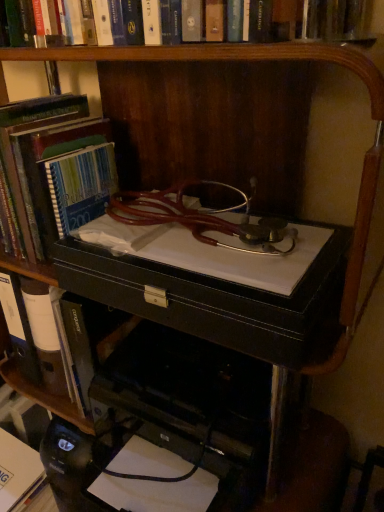
Question: Is black leather drawer at center located outside white paper at lower left, which ranks as the first book in bottom-to-top order?

Choices:
 (A) yes
 (B) no

Answer: (A)

Question: Is black leather drawer at center at the right side of white paper at lower left, marked as the third book in a top-to-bottom arrangement?

Choices:
 (A) no
 (B) yes

Answer: (B)

Question: Does black leather drawer at center turn towards white paper at lower left, which ranks as the first book in bottom-to-top order?

Choices:
 (A) no
 (B) yes

Answer: (A)

Question: Is black leather drawer at center touching white paper at lower left, which ranks as the first book in bottom-to-top order?

Choices:
 (A) no
 (B) yes

Answer: (A)

Question: From a real-world perspective, is black leather drawer at center beneath white paper at lower left, marked as the third book in a top-to-bottom arrangement?

Choices:
 (A) yes
 (B) no

Answer: (B)

Question: Is black leather drawer at center turned away from white paper at lower left, marked as the third book in a top-to-bottom arrangement?

Choices:
 (A) no
 (B) yes

Answer: (A)

Question: From a real-world perspective, is black leather book at center, marked as the 2th book in a bottom-to-top arrangement, on top of black leather computer desk at center?

Choices:
 (A) no
 (B) yes

Answer: (B)

Question: From the image's perspective, is black leather book at center, marked as the 2th book in a bottom-to-top arrangement, below black leather computer desk at center?

Choices:
 (A) no
 (B) yes

Answer: (A)

Question: Does black leather book at center, arranged as the 2th book when viewed from the top, appear on the right side of black leather computer desk at center?

Choices:
 (A) no
 (B) yes

Answer: (A)

Question: Is black leather book at center, arranged as the 2th book when viewed from the top, turned away from black leather computer desk at center?

Choices:
 (A) yes
 (B) no

Answer: (B)

Question: Is black leather book at center, marked as the 2th book in a bottom-to-top arrangement, outside black leather computer desk at center?

Choices:
 (A) no
 (B) yes

Answer: (B)

Question: Are black leather book at center, marked as the 2th book in a bottom-to-top arrangement, and black leather computer desk at center making contact?

Choices:
 (A) no
 (B) yes

Answer: (A)

Question: Is black leather computer desk at center further to the viewer compared to black leather book at center, marked as the 2th book in a bottom-to-top arrangement?

Choices:
 (A) yes
 (B) no

Answer: (B)